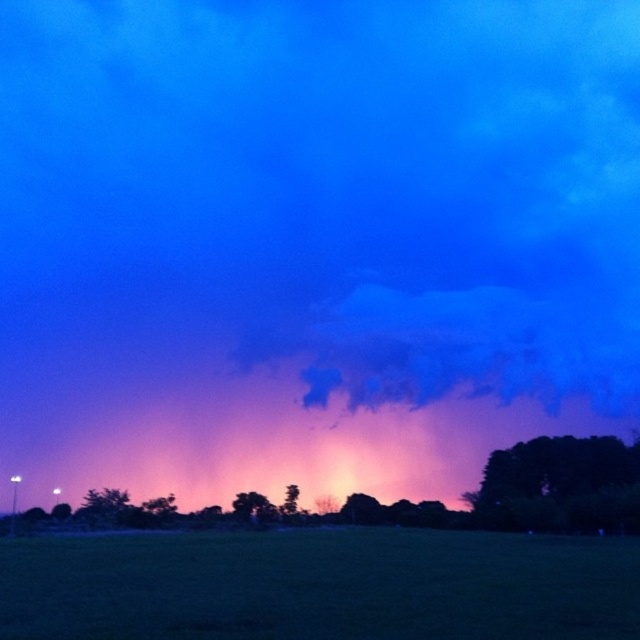
Question: Does green grass at lower center appear over dark green leafy tree at lower right?

Choices:
 (A) no
 (B) yes

Answer: (B)

Question: Which of the following is the closest to the observer?

Choices:
 (A) green matte tree at center
 (B) dark green leafy tree at lower right
 (C) green leafy tree at center

Answer: (B)

Question: Estimate the real-world distances between objects in this image. Which object is closer to the green grass at lower center?

Choices:
 (A) green leafy tree at center
 (B) dark green leafy tree at lower right

Answer: (B)

Question: Can you confirm if green grass at lower center is wider than green leafy tree at center?

Choices:
 (A) yes
 (B) no

Answer: (A)

Question: Can you confirm if green grass at lower center is positioned to the right of dark green leafy tree at lower right?

Choices:
 (A) no
 (B) yes

Answer: (A)

Question: Which of the following is the closest to the observer?

Choices:
 (A) dark green leafy tree at lower right
 (B) green matte tree at center
 (C) green leafy tree at center
 (D) green grass at lower center

Answer: (D)